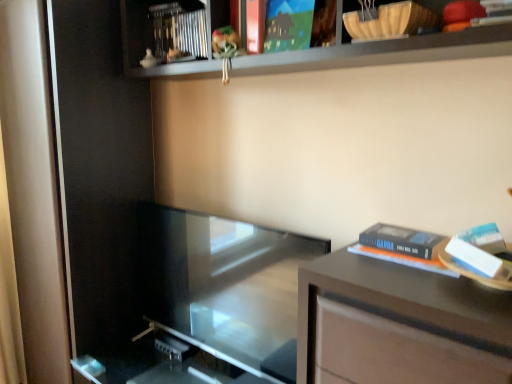
Question: Does matte white screen door at left, which is counted as the second screen door, starting from the right, turn towards hardcover book at right, the 1th paperback book ordered from the bottom?

Choices:
 (A) yes
 (B) no

Answer: (B)

Question: From the image's perspective, is matte white screen door at left, the first screen door positioned from the left, below hardcover book at right, the 1th paperback book viewed from the right?

Choices:
 (A) no
 (B) yes

Answer: (A)

Question: Is matte white screen door at left, which is counted as the second screen door, starting from the right, closer to the viewer compared to hardcover book at right, the 1th paperback book ordered from the bottom?

Choices:
 (A) yes
 (B) no

Answer: (B)

Question: From a real-world perspective, is matte white screen door at left, the first screen door positioned from the left, positioned over hardcover book at right, the 1th paperback book viewed from the right, based on gravity?

Choices:
 (A) yes
 (B) no

Answer: (B)

Question: From the image's perspective, is matte white screen door at left, the first screen door positioned from the left, on hardcover book at right, which ranks as the 2th paperback book in left-to-right order?

Choices:
 (A) yes
 (B) no

Answer: (A)

Question: From their relative heights in the image, would you say transparent glass door at center is taller or shorter than metallic silver book at upper center?

Choices:
 (A) tall
 (B) short

Answer: (A)

Question: Is transparent glass door at center bigger or smaller than metallic silver book at upper center?

Choices:
 (A) small
 (B) big

Answer: (B)

Question: From the image's perspective, is transparent glass door at center positioned above or below metallic silver book at upper center?

Choices:
 (A) below
 (B) above

Answer: (A)

Question: In terms of width, does transparent glass door at center look wider or thinner when compared to metallic silver book at upper center?

Choices:
 (A) wide
 (B) thin

Answer: (B)

Question: Is transparent glass screen door at left, placed as the second screen door when sorted from left to right, inside or outside of metallic silver book at upper center?

Choices:
 (A) inside
 (B) outside

Answer: (B)

Question: Based on their sizes in the image, would you say transparent glass screen door at left, placed as the second screen door when sorted from left to right, is bigger or smaller than metallic silver book at upper center?

Choices:
 (A) small
 (B) big

Answer: (B)

Question: Is point click(x=59, y=132) closer or farther from the camera than point click(x=186, y=52)?

Choices:
 (A) closer
 (B) farther

Answer: (A)

Question: Considering the positions of transparent glass screen door at left, placed as the second screen door when sorted from left to right, and metallic silver book at upper center in the image, is transparent glass screen door at left, placed as the second screen door when sorted from left to right, taller or shorter than metallic silver book at upper center?

Choices:
 (A) tall
 (B) short

Answer: (A)

Question: Does point (111, 59) appear closer or farther from the camera than point (387, 284)?

Choices:
 (A) closer
 (B) farther

Answer: (B)

Question: From a real-world perspective, relative to matte brown table at right, is transparent glass screen door at left, positioned as the 1th screen door in right-to-left order, vertically above or below?

Choices:
 (A) above
 (B) below

Answer: (A)